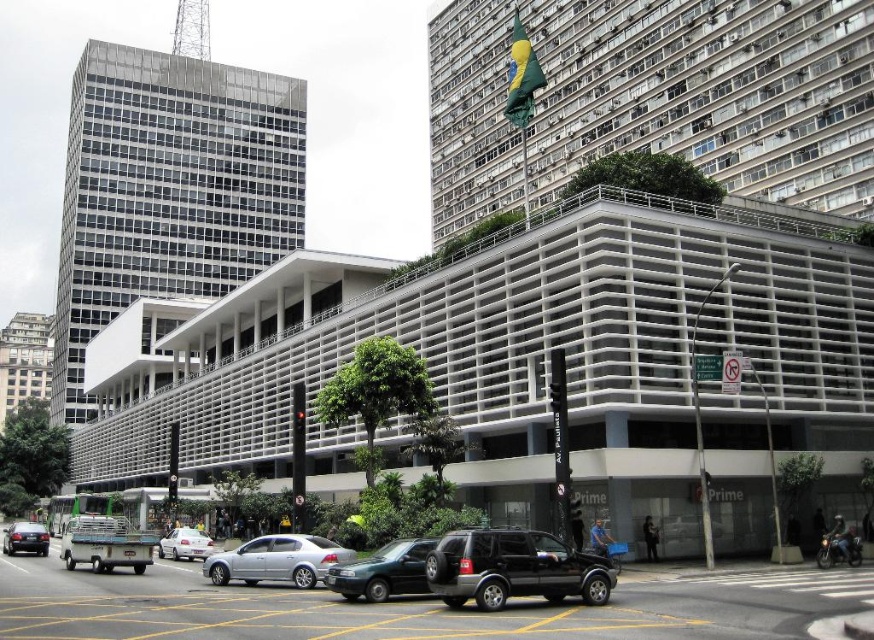
Question: Which is farther from the black matte suv at center?

Choices:
 (A) metallic gray sedan at center
 (B) satin silver sedan at center
 (C) shiny silver sedan at lower left
 (D) silver metallic sedan at center

Answer: (C)

Question: Which object is closer to the camera taking this photo?

Choices:
 (A) shiny silver sedan at lower left
 (B) black matte suv at center

Answer: (B)

Question: Which of the following is the closest to the observer?

Choices:
 (A) (437, 595)
 (B) (230, 563)
 (C) (186, 531)
 (D) (9, 552)

Answer: (A)

Question: Can you confirm if black matte suv at center is positioned to the right of silver metallic sedan at center?

Choices:
 (A) yes
 (B) no

Answer: (A)

Question: Can you confirm if metallic gray sedan at center is wider than silver metallic sedan at center?

Choices:
 (A) no
 (B) yes

Answer: (A)

Question: Can you confirm if metallic gray sedan at center is positioned below shiny silver sedan at lower left?

Choices:
 (A) yes
 (B) no

Answer: (B)